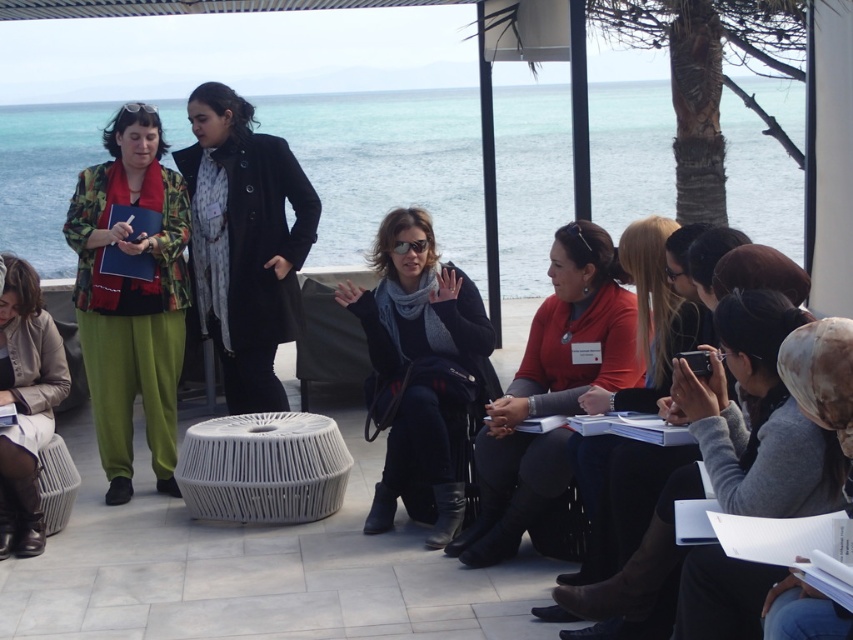
How much distance is there between clear blue water at upper center and matte black jacket at center?

clear blue water at upper center is 25.89 feet away from matte black jacket at center.

Between point (467, 166) and point (689, 296), which one is positioned in front?

Point (689, 296)

Find the location of a particular element. clear blue water at upper center is located at coordinates tap(387, 166).

Who is taller, black wool coat at center or beige leather jacket at lower left?

With more height is black wool coat at center.

Is point (189, 100) positioned in front of point (22, 452)?

No, (189, 100) is further to viewer.

Is point (244, 392) farther from viewer compared to point (3, 291)?

That is True.

Identify the location of black wool coat at center. The width and height of the screenshot is (853, 640). (244, 241).

Between clear blue water at upper center and gray knit sweater at lower right, which one is positioned lower?

gray knit sweater at lower right is below.

Can you confirm if clear blue water at upper center is positioned below gray knit sweater at lower right?

Actually, clear blue water at upper center is above gray knit sweater at lower right.

Identify the location of clear blue water at upper center. Image resolution: width=853 pixels, height=640 pixels. (387, 166).